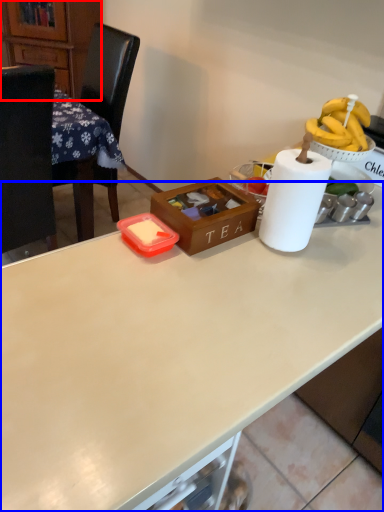
Question: Which of the following is the farthest to the observer, cabinetry (highlighted by a red box) or desk (highlighted by a blue box)?

Choices:
 (A) cabinetry
 (B) desk

Answer: (A)